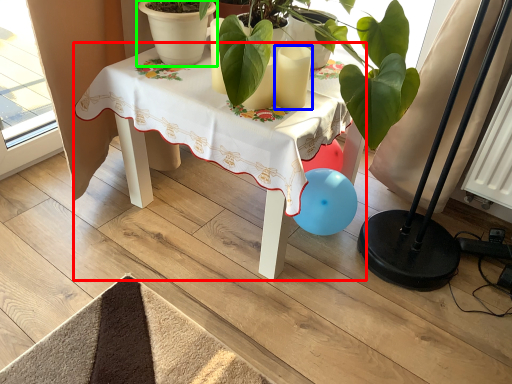
Question: Which object is the farthest from table (highlighted by a red box)? Choose among these: candle (highlighted by a blue box) or flowerpot (highlighted by a green box).

Choices:
 (A) candle
 (B) flowerpot

Answer: (A)